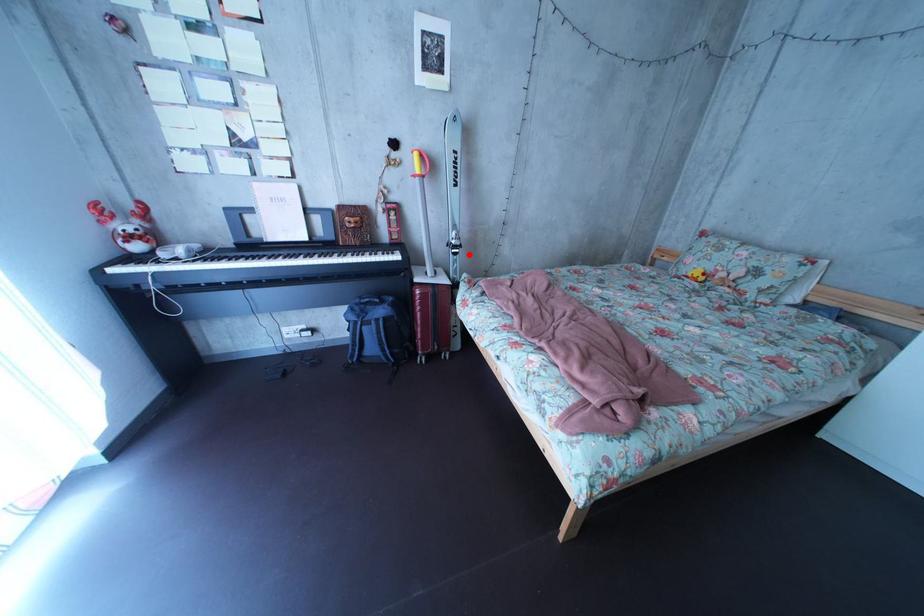
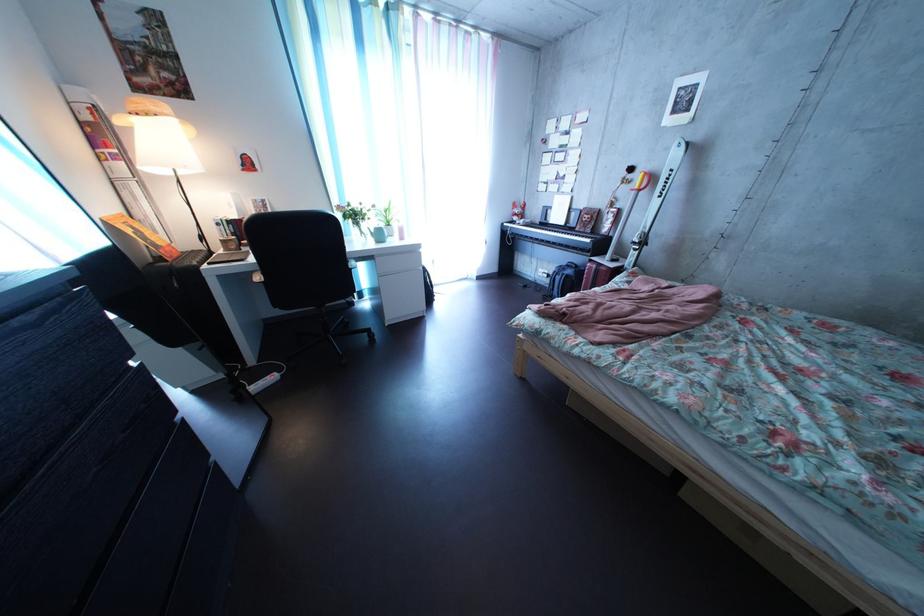
Where in the second image is the point corresponding to the highlighted location from the first image?

(648, 252)